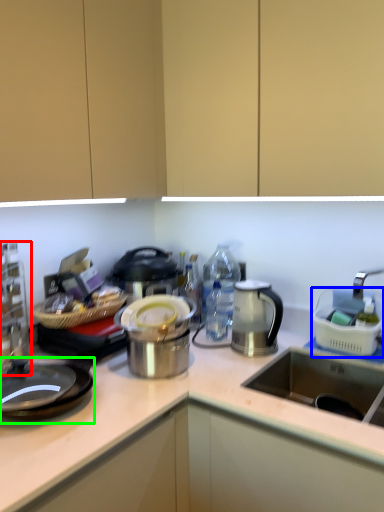
Question: Based on their relative distances, which object is nearer to kitchen appliance (highlighted by a red box)? Choose from appliance (highlighted by a blue box) and gas stove (highlighted by a green box).

Choices:
 (A) appliance
 (B) gas stove

Answer: (B)